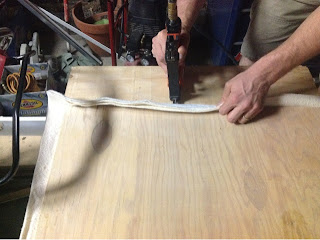
Locate an element on the screen. Image resolution: width=320 pixels, height=240 pixels. yellow extension cord is located at coordinates (28, 81).